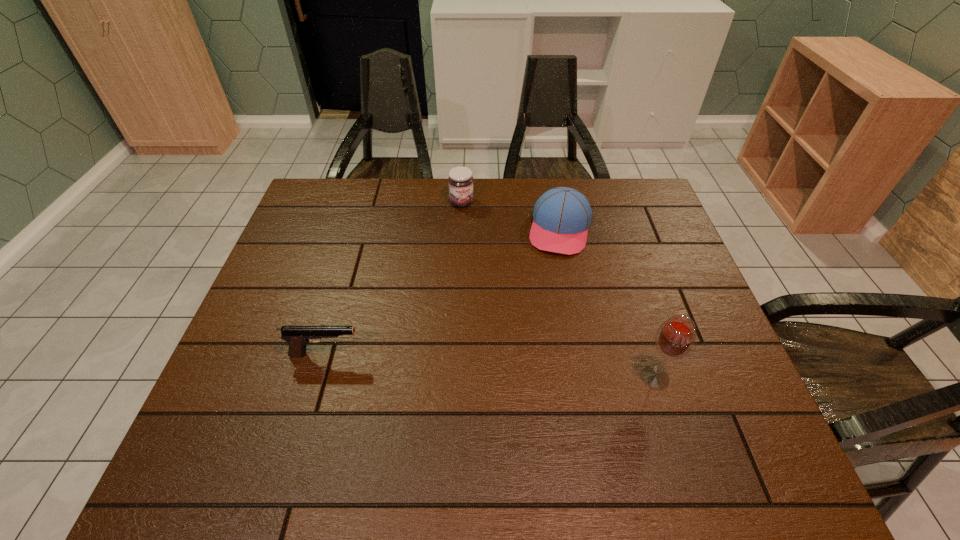
You are a GUI agent. You are given a task and a screenshot of the screen. Output one action in this format:
    pyautogui.click(x=<x>, y=<y>)
    Task: Click on the vacant area between the third farthest object and the baseball cap
    
    Given the screenshot: What is the action you would take?
    pyautogui.click(x=443, y=292)

Where is `free space between the jam and the wineglass`? The width and height of the screenshot is (960, 540). free space between the jam and the wineglass is located at coordinates (559, 290).

The height and width of the screenshot is (540, 960). In order to click on vacant region between the baseball cap and the jam in this screenshot , I will do `click(511, 216)`.

Identify the location of free space between the wineglass and the second object from left to right. (559, 290).

Locate an element on the screen. vacant area between the baseball cap and the rightmost object is located at coordinates (608, 303).

Where is `blank region between the leftmost object and the third object from right to left`? blank region between the leftmost object and the third object from right to left is located at coordinates (394, 278).

Identify the location of free space between the pistol and the baseball cap. (443, 292).

Where is `the third closest object to the jam`? the third closest object to the jam is located at coordinates (675, 337).

What are the coordinates of `object that can be found as the closest to the baseball cap` in the screenshot? It's located at (460, 181).

Identify the location of free space that satisfies the following two spatial constraints: 1. on the front side of the jam; 2. on the left side of the tallest object. The image size is (960, 540). (453, 377).